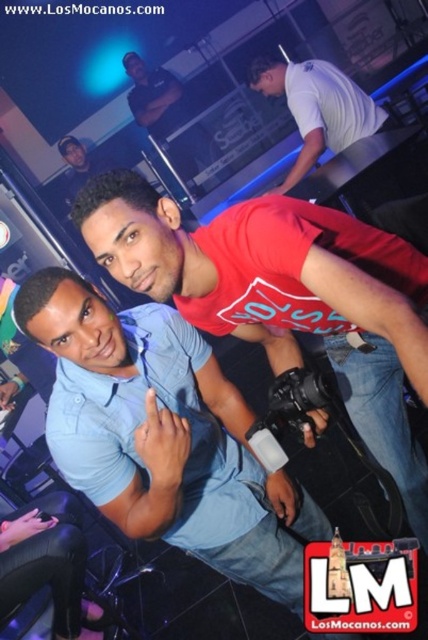
Question: Does blue cotton shirt at center have a larger size compared to matte black shirt at upper center?

Choices:
 (A) no
 (B) yes

Answer: (A)

Question: Which point is closer to the camera?

Choices:
 (A) (324, 92)
 (B) (160, 100)

Answer: (A)

Question: Which object is closer to the camera taking this photo?

Choices:
 (A) matte black shirt at upper center
 (B) white matte shirt at upper center
 (C) blue cotton shirt at center

Answer: (C)

Question: Can you confirm if blue cotton shirt at center is positioned below matte blue shirt at center?

Choices:
 (A) no
 (B) yes

Answer: (B)

Question: Which object is the farthest from the blue cotton shirt at center?

Choices:
 (A) matte blue shirt at center
 (B) matte black shirt at upper center

Answer: (B)

Question: Considering the relative positions of blue cotton shirt at center and matte blue shirt at center in the image provided, where is blue cotton shirt at center located with respect to matte blue shirt at center?

Choices:
 (A) below
 (B) above

Answer: (A)